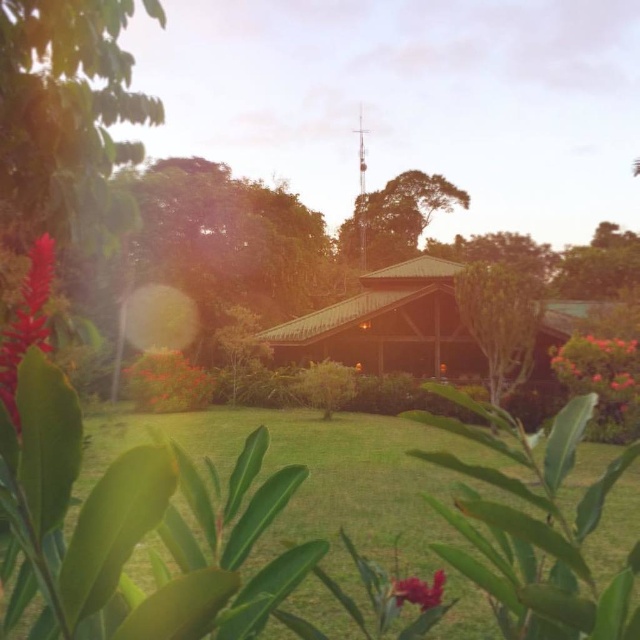
You are standing in the scene and want to pick the matte red flower at lower center. Which direction should you move to reach it from the green grass at center?

Since the green grass at center is closer to the viewer than the matte red flower at lower center, you should move backward to reach the matte red flower at lower center.

You are a landscape architect designing a garden path that must pass between the green textured roof at center and the bright pink petals at right. The path needs to be at least 2 meters wide to accommodate a wheelbarrow. Can the space between them accommodate this width?

The green textured roof at center is wider than the bright pink petals at right, but the exact width between them isn

Based on the scene description, where is the green grass at center located in terms of coordinates?

The green grass at center is located at coordinates point (x=340, y=488).